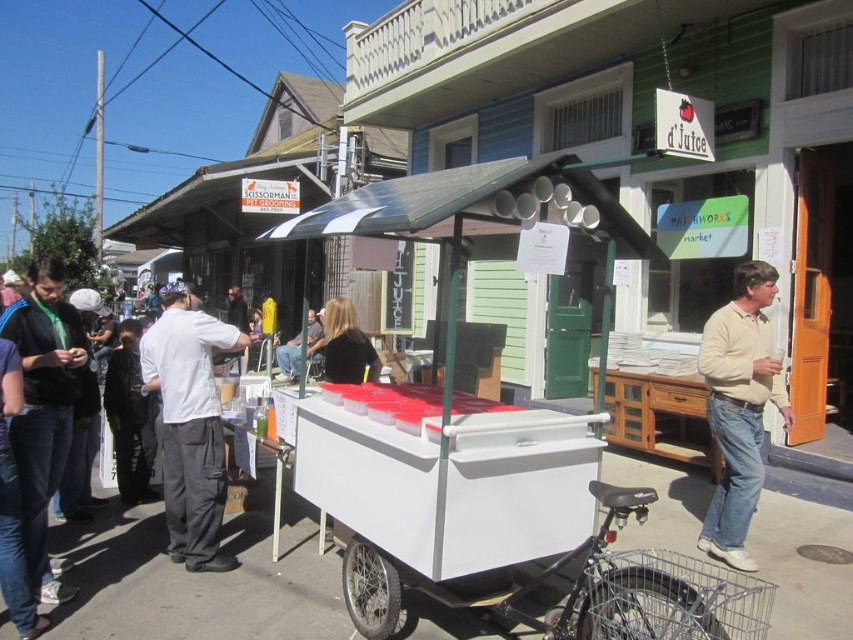
Does light beige sweater at right lie in front of matte black jacket at left?

No, it is not.

Locate an element on the screen. The height and width of the screenshot is (640, 853). light beige sweater at right is located at coordinates (740, 406).

Identify the location of light beige sweater at right. (740, 406).

How distant is white cotton shirt at center from light beige sweater at right?

A distance of 3.31 meters exists between white cotton shirt at center and light beige sweater at right.

Does point (206, 438) come farther from viewer compared to point (726, 531)?

No, (206, 438) is closer to viewer.

Find the location of `white cotton shirt at center`. white cotton shirt at center is located at coordinates (190, 426).

Which is above, light beige sweater at right or light brown leather jacket at center?

light beige sweater at right

Can you confirm if light beige sweater at right is smaller than light brown leather jacket at center?

Yes.

Describe the element at coordinates (740, 406) in the screenshot. I see `light beige sweater at right` at that location.

Find the location of a particular element. light beige sweater at right is located at coordinates (740, 406).